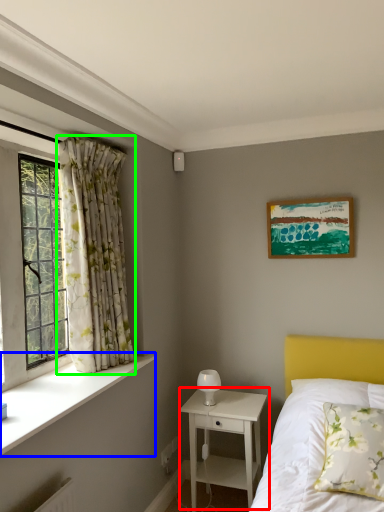
Question: Considering the real-world distances, which object is closest to nightstand (highlighted by a red box)? window sill (highlighted by a blue box) or curtain (highlighted by a green box).

Choices:
 (A) window sill
 (B) curtain

Answer: (A)